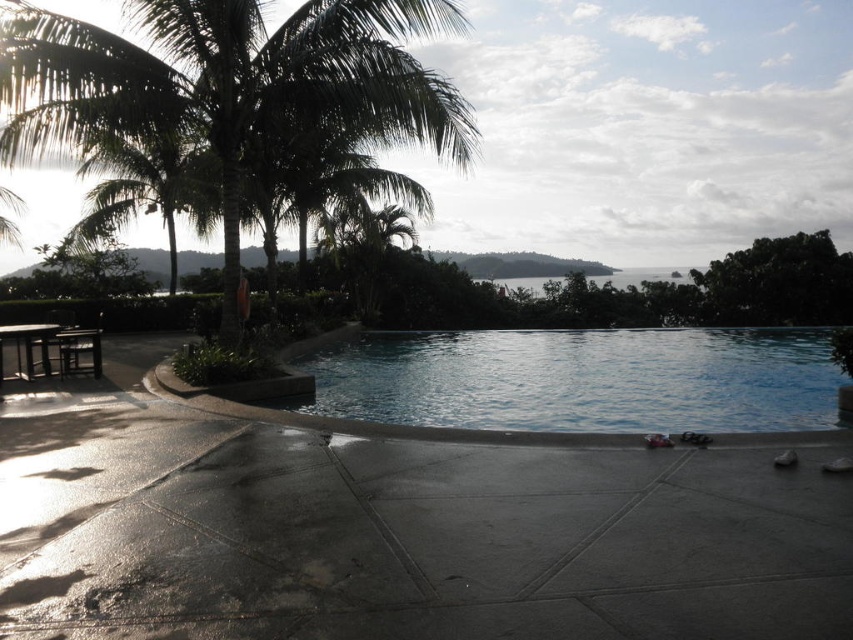
How far apart are green leafy palm tree at upper left and clear blue water at center?

green leafy palm tree at upper left and clear blue water at center are 6.25 meters apart from each other.

Does green leafy palm tree at upper left appear under clear blue water at center?

Incorrect, green leafy palm tree at upper left is not positioned below clear blue water at center.

Measure the distance between green leafy palm tree at upper left and camera.

green leafy palm tree at upper left is 26.40 feet away from camera.

Locate an element on the screen. This screenshot has height=640, width=853. green leafy palm tree at upper left is located at coordinates (231, 81).